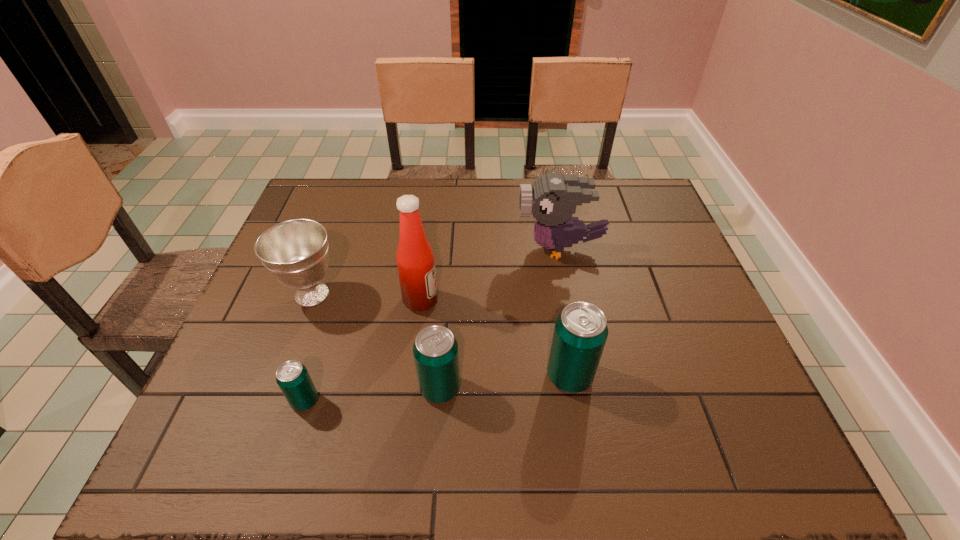
Where is `the closest beer can relative to the tallest object`? This screenshot has width=960, height=540. the closest beer can relative to the tallest object is located at coordinates (435, 350).

This screenshot has height=540, width=960. Find the location of `vacant space that satisfies the following two spatial constraints: 1. at the beak of the bird; 2. on the front side of the chalice`. vacant space that satisfies the following two spatial constraints: 1. at the beak of the bird; 2. on the front side of the chalice is located at coordinates (568, 294).

Where is `vacant area that satisfies the following two spatial constraints: 1. at the beak of the bird; 2. on the front side of the second shortest beer can`? vacant area that satisfies the following two spatial constraints: 1. at the beak of the bird; 2. on the front side of the second shortest beer can is located at coordinates (587, 388).

This screenshot has width=960, height=540. What are the coordinates of `free space that satisfies the following two spatial constraints: 1. at the beak of the farthest object; 2. on the front side of the chalice` in the screenshot? It's located at (568, 294).

The width and height of the screenshot is (960, 540). What are the coordinates of `free location that satisfies the following two spatial constraints: 1. on the front-facing side of the condiment; 2. on the left side of the second beer can from left to right` in the screenshot? It's located at [x=410, y=388].